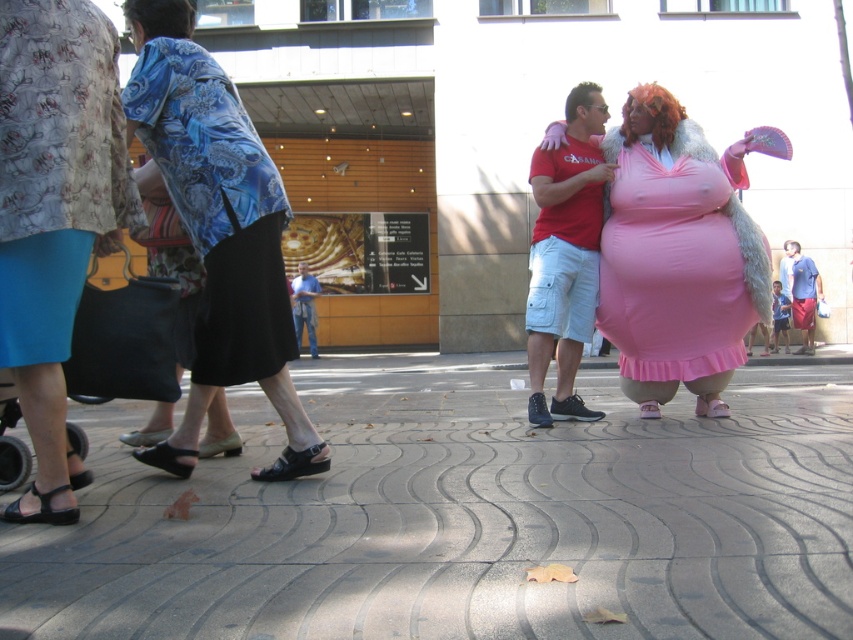
You are standing in the plaza and see two points marked in the image. Which point, point (813, 321) or point (309, 344), is closer to you?

Point (813, 321) is closer to the viewer than point (309, 344).